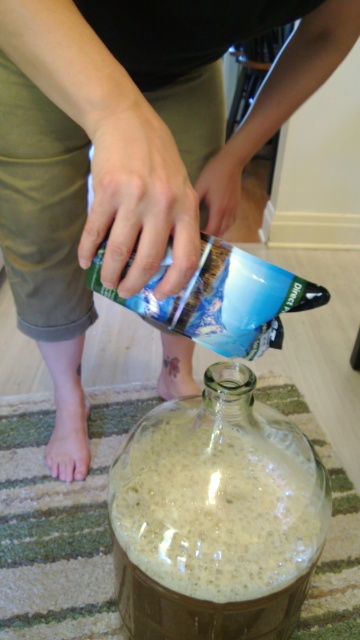
Question: Does transparent glass jar at lower center come behind pale skin at lower left?

Choices:
 (A) yes
 (B) no

Answer: (B)

Question: Among these points, which one is nearest to the camera?

Choices:
 (A) (79, 461)
 (B) (164, 566)

Answer: (B)

Question: Among these objects, which one is farthest from the camera?

Choices:
 (A) transparent glass jar at lower center
 (B) pale skin at lower left

Answer: (B)

Question: Which object is closer to the camera taking this photo?

Choices:
 (A) pale skin at lower left
 (B) transparent glass jar at lower center

Answer: (B)

Question: Can you confirm if transparent glass jar at lower center is bigger than pale skin at lower left?

Choices:
 (A) yes
 (B) no

Answer: (A)

Question: Can you confirm if transparent glass jar at lower center is positioned to the left of pale skin at lower left?

Choices:
 (A) no
 (B) yes

Answer: (A)